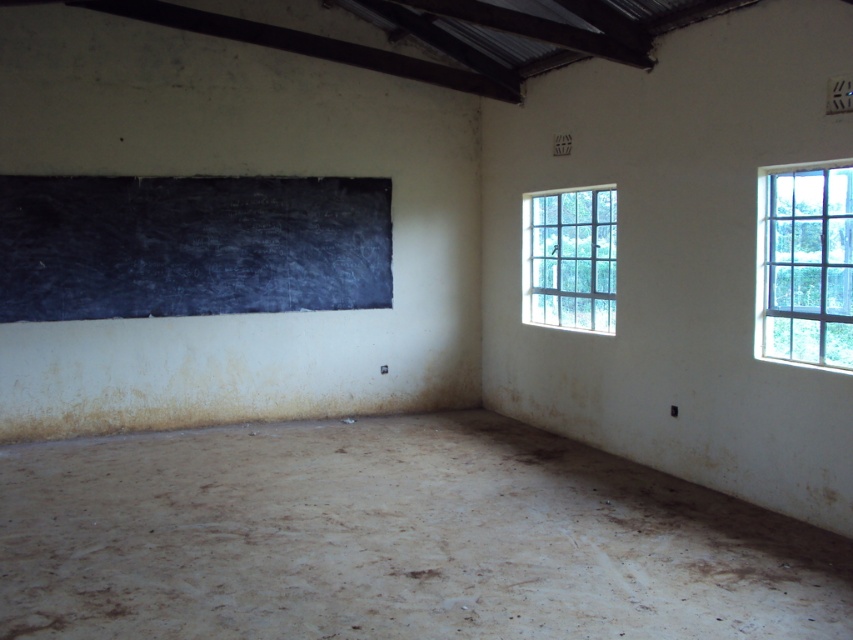
Question: Estimate the real-world distances between objects in this image. Which object is closer to the black chalkboard at upper left?

Choices:
 (A) clear glass window at right
 (B) clear glass window at upper right

Answer: (A)

Question: Can you confirm if black chalkboard at upper left is wider than clear glass window at upper right?

Choices:
 (A) yes
 (B) no

Answer: (A)

Question: Does black chalkboard at upper left have a greater width compared to clear glass window at right?

Choices:
 (A) yes
 (B) no

Answer: (A)

Question: Does black chalkboard at upper left lie in front of clear glass window at upper right?

Choices:
 (A) no
 (B) yes

Answer: (A)

Question: Considering the real-world distances, which object is closest to the clear glass window at right?

Choices:
 (A) clear glass window at upper right
 (B) black chalkboard at upper left

Answer: (A)

Question: Which point appears farthest from the camera in this image?

Choices:
 (A) (195, 284)
 (B) (764, 225)

Answer: (A)